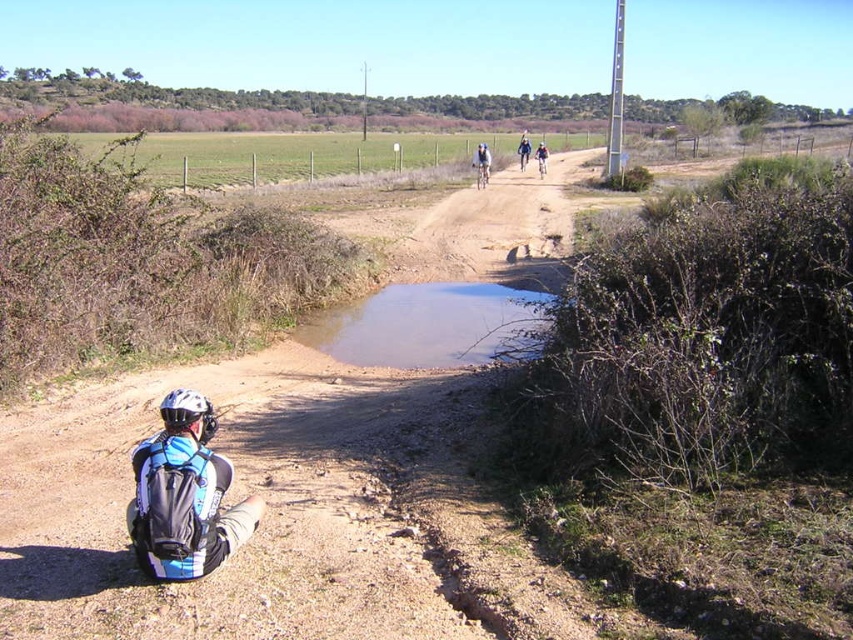
Question: Is blue matte dirt bike at center above shiny blue dirt bike at center?

Choices:
 (A) yes
 (B) no

Answer: (B)

Question: Which point is closer to the camera taking this photo?

Choices:
 (A) (456, 339)
 (B) (245, 502)
 (C) (479, 186)

Answer: (B)

Question: Does brown muddy puddle at center appear over white matte bicycle helmet at lower left?

Choices:
 (A) yes
 (B) no

Answer: (A)

Question: Does blue fabric jacket at upper center have a greater width compared to shiny blue dirt bike at center?

Choices:
 (A) yes
 (B) no

Answer: (A)

Question: Which point is farther from the camera taking this photo?

Choices:
 (A) (196, 406)
 (B) (514, 323)

Answer: (B)

Question: Which of the following is the closest to the observer?

Choices:
 (A) (518, 154)
 (B) (473, 298)

Answer: (B)